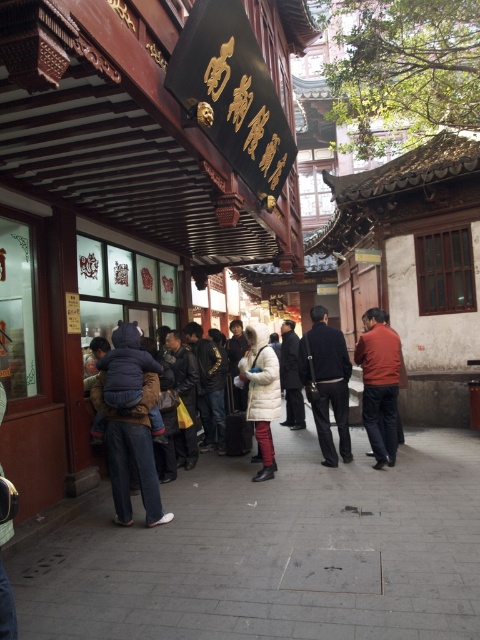
From the picture: Who is more distant from viewer, (x=69, y=556) or (x=152, y=372)?

The point (x=152, y=372) is more distant.

This screenshot has width=480, height=640. Describe the element at coordinates (275, 552) in the screenshot. I see `concrete pavement at center` at that location.

Where is `concrete pavement at center`? Image resolution: width=480 pixels, height=640 pixels. concrete pavement at center is located at coordinates (275, 552).

Is concrete pavement at center wider than dark gray suit at center?

Correct, the width of concrete pavement at center exceeds that of dark gray suit at center.

Is concrete pavement at center further to the viewer compared to dark gray suit at center?

No.

Locate an element on the screen. The image size is (480, 640). concrete pavement at center is located at coordinates (275, 552).

Where is `concrete pavement at center`? concrete pavement at center is located at coordinates (275, 552).

Is concrete pavement at center above black matte jacket at center?

Incorrect, concrete pavement at center is not positioned above black matte jacket at center.

Is concrete pavement at center thinner than black matte jacket at center?

In fact, concrete pavement at center might be wider than black matte jacket at center.

Is point (445, 524) behind point (331, 342)?

No, it is in front of (331, 342).

Identify the location of concrete pavement at center. The height and width of the screenshot is (640, 480). (275, 552).